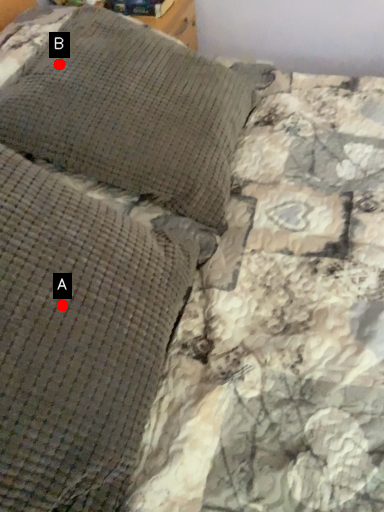
Question: Two points are circled on the image, labeled by A and B beside each circle. Among these points, which one is nearest to the camera?

Choices:
 (A) A is closer
 (B) B is closer

Answer: (A)